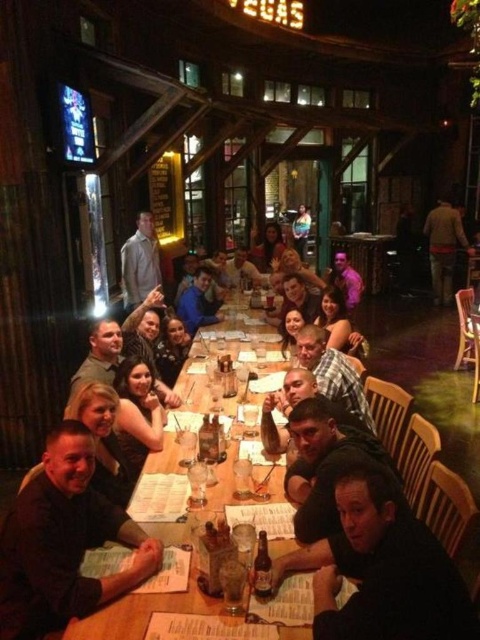
You are standing at the entrance of the Vegas restaurant and see a person wearing a matte black shirt at lower left. Can you tell me the exact coordinates where this person is located?

The matte black shirt at lower left is located at coordinates point (63, 541).

You are a waiter at the Vegas restaurant. You need to deliver a drink to the customer wearing the plaid shirt at center and the smooth brown leather jacket at center. Which customer should you approach first if you want to serve the one closer to the entrance?

The plaid shirt at center is positioned under the smooth brown leather jacket at center, meaning the plaid shirt is closer to the entrance. Therefore, you should approach the customer wearing the plaid shirt at center first.

You are a waiter at the Vegas restaurant. You need to deliver a drink to the person wearing the plaid shirt at center and the smooth brown leather jacket at center. Which person is seated to the left of the other?

The plaid shirt at center is positioned on the right side of smooth brown leather jacket at center, so the person wearing the smooth brown leather jacket at center is seated to the left of the person in the plaid shirt at center.